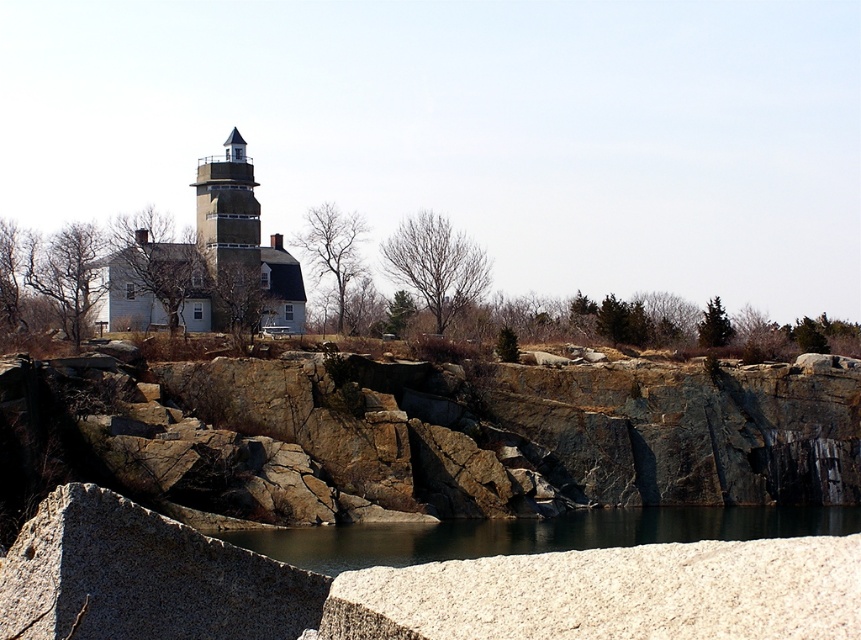
You are standing on the rocky shore looking at the scene. Which object is closer to you, the dark gray water at center or the matte gray stone tower at center?

The dark gray water at center is closer to you because it is in front of the matte gray stone tower at center.

You are a bird flying over the coastal landscape. You see the brown rock cliff at center and the matte gray stone tower at center. Which object is closer to you as you fly overhead?

The brown rock cliff at center is closer to you because it is positioned in front of the matte gray stone tower at center from your perspective.